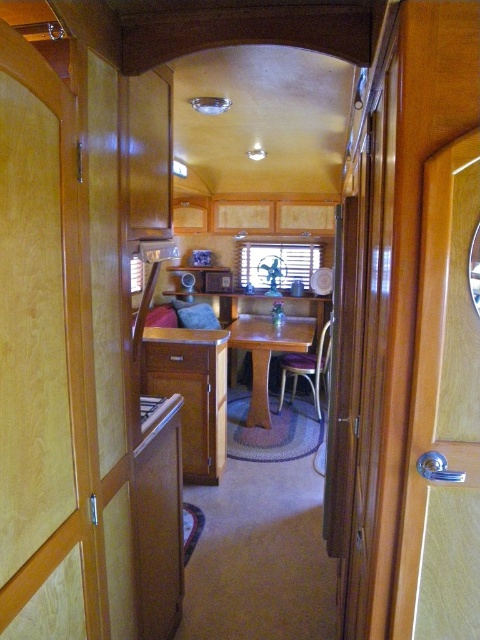
Does wooden table at center have a greater width compared to metallic purple chair at center?

Correct, the width of wooden table at center exceeds that of metallic purple chair at center.

Between wooden table at center and metallic purple chair at center, which one is positioned higher?

wooden table at center

Measure the distance between point (263, 392) and camera.

Point (263, 392) and camera are 4.08 meters apart from each other.

What are the coordinates of `wooden table at center` in the screenshot? It's located at (265, 353).

What do you see at coordinates (265, 353) in the screenshot?
I see `wooden table at center` at bounding box center [265, 353].

Does point (250, 342) lie behind point (195, 369)?

Yes, it is behind point (195, 369).

I want to click on wooden table at center, so click(265, 353).

Which is more to the left, metallic purple chair at center or wooden drawer at center?

wooden drawer at center

Is metallic purple chair at center smaller than wooden drawer at center?

Actually, metallic purple chair at center might be larger than wooden drawer at center.

Which is in front, point (312, 355) or point (176, 353)?

Positioned in front is point (176, 353).

You are a GUI agent. You are given a task and a screenshot of the screen. Output one action in this format:
    pyautogui.click(x=<x>, y=<y>)
    Task: Click on the metallic purple chair at center
    Image resolution: width=480 pixels, height=640 pixels.
    Given the screenshot: What is the action you would take?
    pyautogui.click(x=307, y=369)